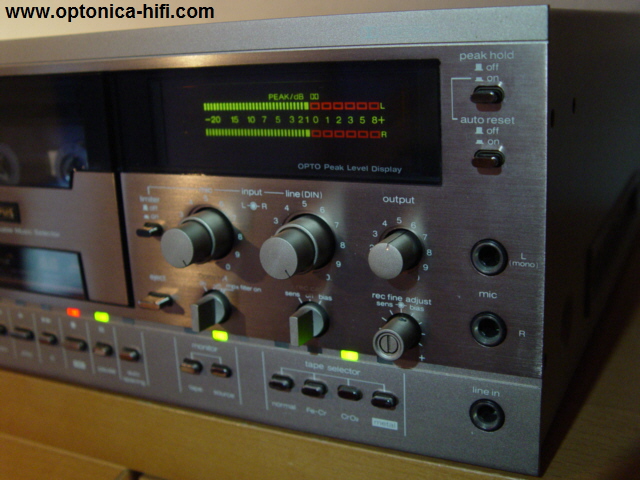
You are a GUI agent. You are given a task and a screenshot of the screen. Output one action in this format:
    pyautogui.click(x=<x>, y=<y>)
    Task: Click on the receiver
    This screenshot has width=640, height=480.
    Given the screenshot: What is the action you would take?
    pyautogui.click(x=524, y=67)